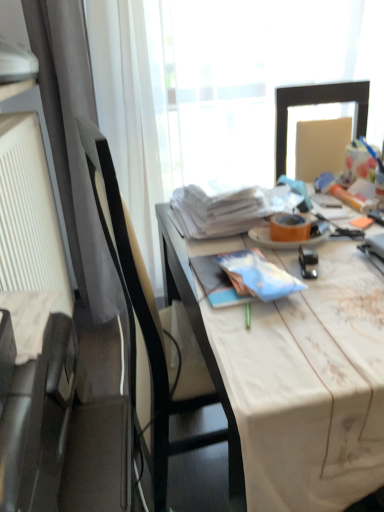
Question: Choose the correct answer: Is white fabric-covered desk at center inside orange matte plate at center or outside it?

Choices:
 (A) outside
 (B) inside

Answer: (A)

Question: From a real-world perspective, is white fabric-covered desk at center above or below orange matte plate at center?

Choices:
 (A) above
 (B) below

Answer: (B)

Question: Based on their relative distances, which object is farther from the orange matte plate at center?

Choices:
 (A) white textured radiator at left
 (B) black leather chair at left
 (C) white fabric-covered desk at center
 (D) metallic black stapler at center-right

Answer: (A)

Question: Which of these objects is positioned closest to the white textured radiator at left?

Choices:
 (A) orange matte plate at center
 (B) white fabric-covered desk at center
 (C) metallic black stapler at center-right
 (D) black leather chair at left

Answer: (D)